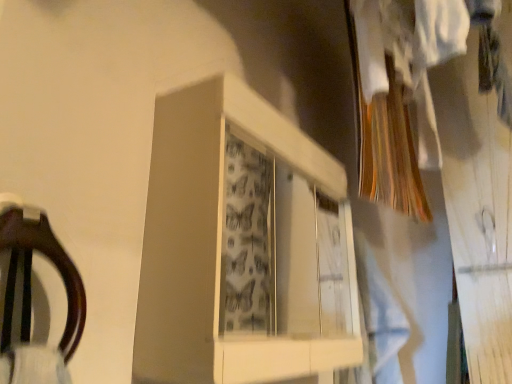
In the scene shown: What is the approximate height of white glossy cabinet at center?

white glossy cabinet at center is 19.52 inches in height.

The width and height of the screenshot is (512, 384). Describe the element at coordinates (242, 246) in the screenshot. I see `white glossy cabinet at center` at that location.

You are a GUI agent. You are given a task and a screenshot of the screen. Output one action in this format:
    pyautogui.click(x=<x>, y=<y>)
    Task: Click on the white glossy cabinet at center
    The height and width of the screenshot is (384, 512).
    Given the screenshot: What is the action you would take?
    pyautogui.click(x=242, y=246)

In order to face white glossy cabinet at center, should I rotate leftwards or rightwards?

Rotate right and turn 3.238 degrees.

Find the location of a particular element. The image size is (512, 384). light blue fabric at center is located at coordinates (376, 324).

What is the approximate width of light blue fabric at center?

light blue fabric at center is 8.14 inches wide.

What do you see at coordinates (376, 324) in the screenshot?
I see `light blue fabric at center` at bounding box center [376, 324].

Identify the location of white glossy cabinet at center. The image size is (512, 384). (242, 246).

Looking at this image, does light blue fabric at center appear on the right side of white glossy cabinet at center?

Yes.

Does light blue fabric at center come behind white glossy cabinet at center?

Yes, light blue fabric at center is behind white glossy cabinet at center.

Between point (385, 303) and point (279, 283), which one is positioned behind?

The point (279, 283) is farther from the camera.

From the image's perspective, which is below, light blue fabric at center or white glossy cabinet at center?

From the image's view, light blue fabric at center is below.

From a real-world perspective, between light blue fabric at center and white glossy cabinet at center, who is vertically higher?

white glossy cabinet at center, from a real-world perspective.

Can you confirm if light blue fabric at center is wider than white glossy cabinet at center?

Correct, the width of light blue fabric at center exceeds that of white glossy cabinet at center.

In terms of height, does light blue fabric at center look taller or shorter compared to white glossy cabinet at center?

Considering their sizes, light blue fabric at center has more height than white glossy cabinet at center.

Does light blue fabric at center have a smaller size compared to white glossy cabinet at center?

Correct, light blue fabric at center occupies less space than white glossy cabinet at center.

Based on the photo, is light blue fabric at center spatially inside white glossy cabinet at center, or outside of it?

light blue fabric at center cannot be found inside white glossy cabinet at center.

Is light blue fabric at center placed right next to white glossy cabinet at center?

light blue fabric at center is not next to white glossy cabinet at center, and they're not touching.

Is light blue fabric at center aimed at white glossy cabinet at center?

No, light blue fabric at center does not turn towards white glossy cabinet at center.

Can you tell me how much light blue fabric at center and white glossy cabinet at center differ in facing direction?

They differ by 1.3 degrees in their facing directions.

Locate an element on the screen. This screenshot has height=384, width=512. clothing below the white glossy cabinet at center (from the image's perspective) is located at coordinates (376, 324).

Considering the positions of objects white glossy cabinet at center and light blue fabric at center in the image provided, who is more to the left, white glossy cabinet at center or light blue fabric at center?

From the viewer's perspective, white glossy cabinet at center appears more on the left side.

Does white glossy cabinet at center lie behind light blue fabric at center?

No, the depth of white glossy cabinet at center is less than that of light blue fabric at center.

Does point (301, 374) come in front of point (366, 295)?

Yes, point (301, 374) is closer to viewer.

From the image's perspective, who appears lower, white glossy cabinet at center or light blue fabric at center?

From the image's view, light blue fabric at center is below.

From a real-world perspective, is white glossy cabinet at center positioned over light blue fabric at center based on gravity?

Yes.

Is white glossy cabinet at center wider or thinner than light blue fabric at center?

Clearly, white glossy cabinet at center has less width compared to light blue fabric at center.

Is white glossy cabinet at center shorter than light blue fabric at center?

Indeed, white glossy cabinet at center has a lesser height compared to light blue fabric at center.

Based on the photo, considering the sizes of objects white glossy cabinet at center and light blue fabric at center in the image provided, who is bigger, white glossy cabinet at center or light blue fabric at center?

With larger size is white glossy cabinet at center.

Would you say white glossy cabinet at center is outside light blue fabric at center?

Result: Yes, white glossy cabinet at center is located beyond the bounds of light blue fabric at center.

Would you consider white glossy cabinet at center to be distant from light blue fabric at center?

No, white glossy cabinet at center is not far away from light blue fabric at center.

Is white glossy cabinet at center facing away from light blue fabric at center?

No, light blue fabric at center is not at the back of white glossy cabinet at center.

How different are the orientations of white glossy cabinet at center and light blue fabric at center in degrees?

1.3 degrees separate the facing orientations of white glossy cabinet at center and light blue fabric at center.

Locate an element on the screen. cabinet in front of the light blue fabric at center is located at coordinates (242, 246).

Where is `clothing behind the white glossy cabinet at center`? clothing behind the white glossy cabinet at center is located at coordinates (376, 324).

Where is `cabinet above the light blue fabric at center (from a real-world perspective)`? This screenshot has width=512, height=384. cabinet above the light blue fabric at center (from a real-world perspective) is located at coordinates (242, 246).